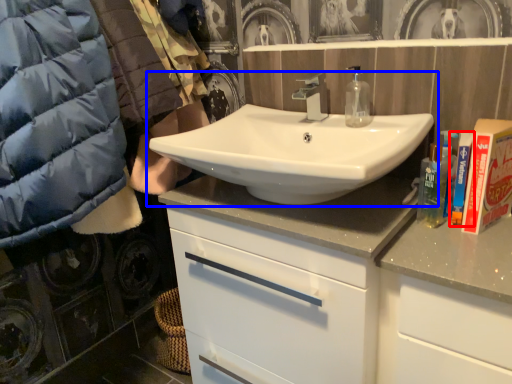
Question: Which object is further to the camera taking this photo, toiletry (highlighted by a red box) or sink (highlighted by a blue box)?

Choices:
 (A) toiletry
 (B) sink

Answer: (A)